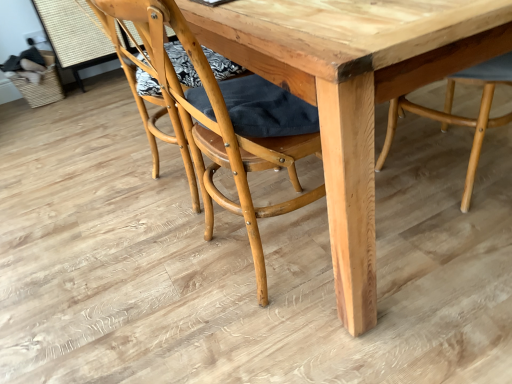
Where is `free space to the left of natural wood chair at center, the first chair when ordered from left to right`? The image size is (512, 384). free space to the left of natural wood chair at center, the first chair when ordered from left to right is located at coordinates (135, 274).